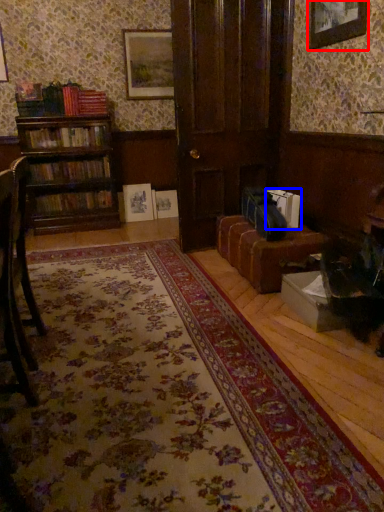
Question: Which of the following is the farthest to the observer, picture frame (highlighted by a red box) or book (highlighted by a blue box)?

Choices:
 (A) picture frame
 (B) book

Answer: (B)